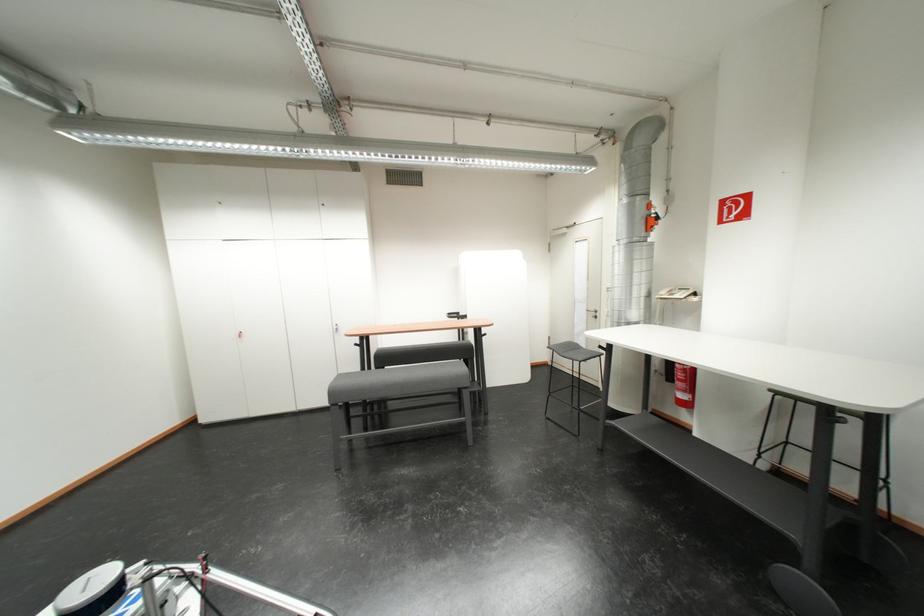
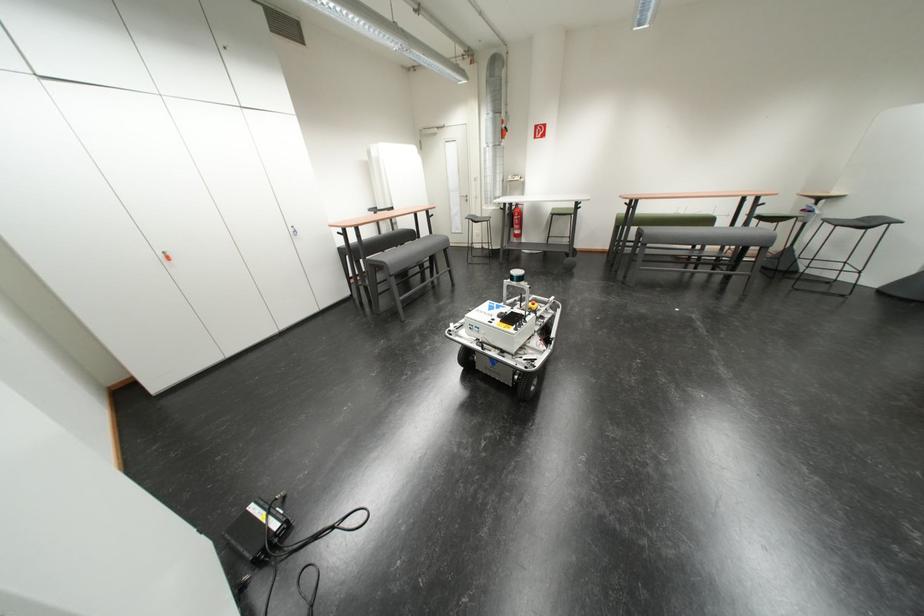
In the second image, find the point that corresponds to (x=612, y=350) in the first image.

(512, 211)